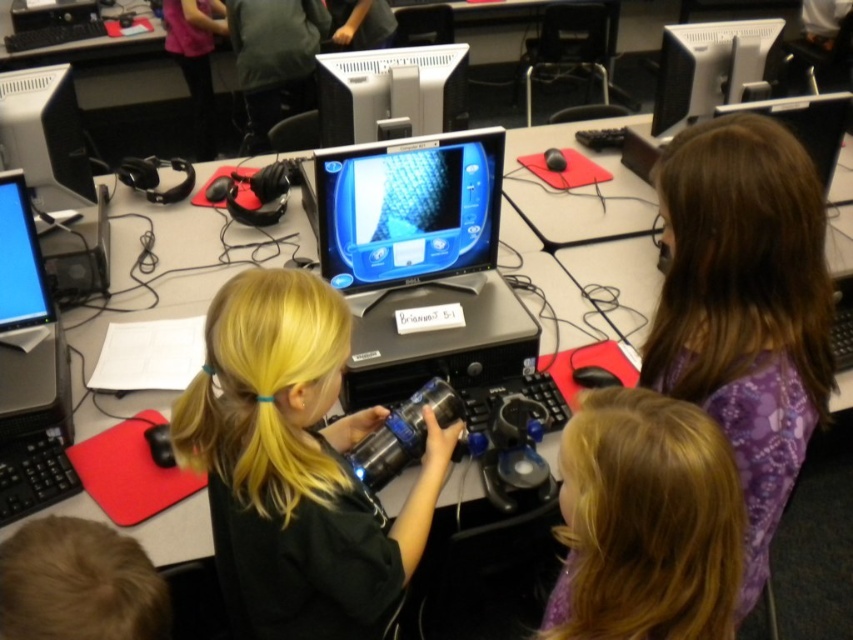
Is satin black monitor at center shorter than matte black monitor at left?

Indeed, satin black monitor at center has a lesser height compared to matte black monitor at left.

Which is in front, point (387, 136) or point (61, 205)?

Point (387, 136) is in front.

At what (x,y) coordinates should I click in order to perform the action: click on satin black monitor at center. Please return your answer as a coordinate pair (x, y). The width and height of the screenshot is (853, 640). Looking at the image, I should click on (390, 92).

Is point (688, 236) more distant than point (668, 52)?

No, it is not.

The height and width of the screenshot is (640, 853). Describe the element at coordinates (746, 307) in the screenshot. I see `purple floral dress at center` at that location.

Find the location of a particular element. This screenshot has height=640, width=853. purple floral dress at center is located at coordinates (746, 307).

From the picture: Who is positioned more to the right, black matte laptop at center or matte black monitor at left?

black matte laptop at center is more to the right.

Does black matte laptop at center appear over matte black monitor at left?

No, black matte laptop at center is not above matte black monitor at left.

Based on the photo, measure the distance between point (245, 545) and camera.

They are 1.03 meters apart.

Where is `black matte laptop at center`? The image size is (853, 640). black matte laptop at center is located at coordinates (296, 467).